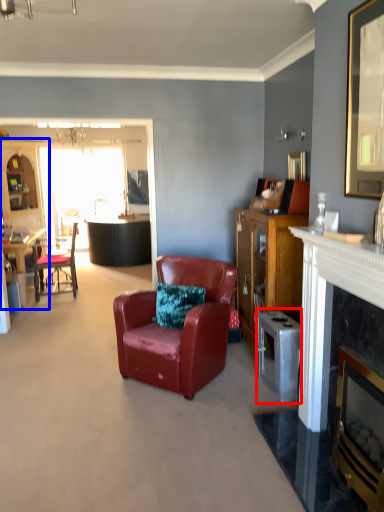
Question: Which point is further to the camera, appliance (highlighted by a red box) or entertainment center (highlighted by a blue box)?

Choices:
 (A) appliance
 (B) entertainment center

Answer: (B)